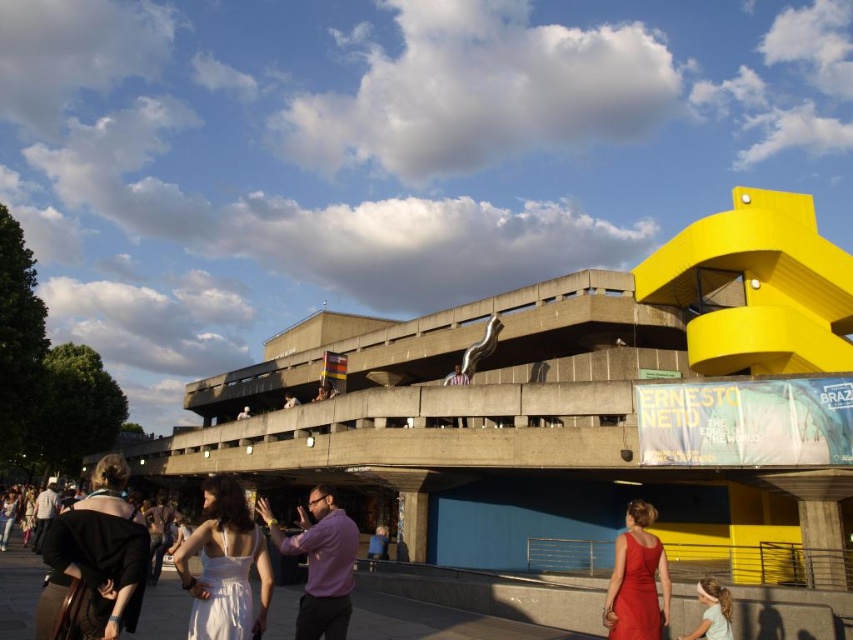
Consider the image. Between matte white dress at center and white fabric shirt at center, which one appears on the left side from the viewer's perspective?

Positioned to the left is white fabric shirt at center.

Between point (456, 364) and point (297, 403), which one is positioned in front?

Positioned in front is point (456, 364).

Identify the location of matte white dress at center. (456, 376).

Is black fabric dress at lower left positioned before white fabric shirt at center?

That is True.

Does point (120, 552) come farther from viewer compared to point (285, 406)?

No, (120, 552) is in front of (285, 406).

I want to click on black fabric dress at lower left, so click(94, 563).

Is purple matte shirt at center smaller than matte red dress at lower center?

Incorrect, purple matte shirt at center is not smaller in size than matte red dress at lower center.

How distant is purple matte shirt at center from matte red dress at lower center?

purple matte shirt at center and matte red dress at lower center are 16.21 meters apart.

Is point (306, 600) farther from viewer compared to point (665, 577)?

Yes.

At what (x,y) coordinates should I click in order to perform the action: click on purple matte shirt at center. Please return your answer as a coordinate pair (x, y). This screenshot has height=640, width=853. Looking at the image, I should click on [318, 563].